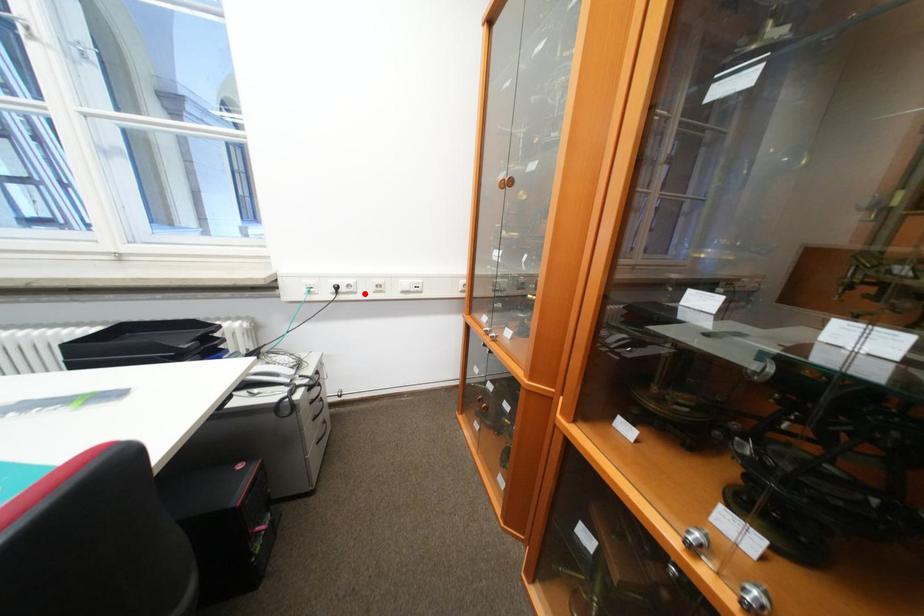
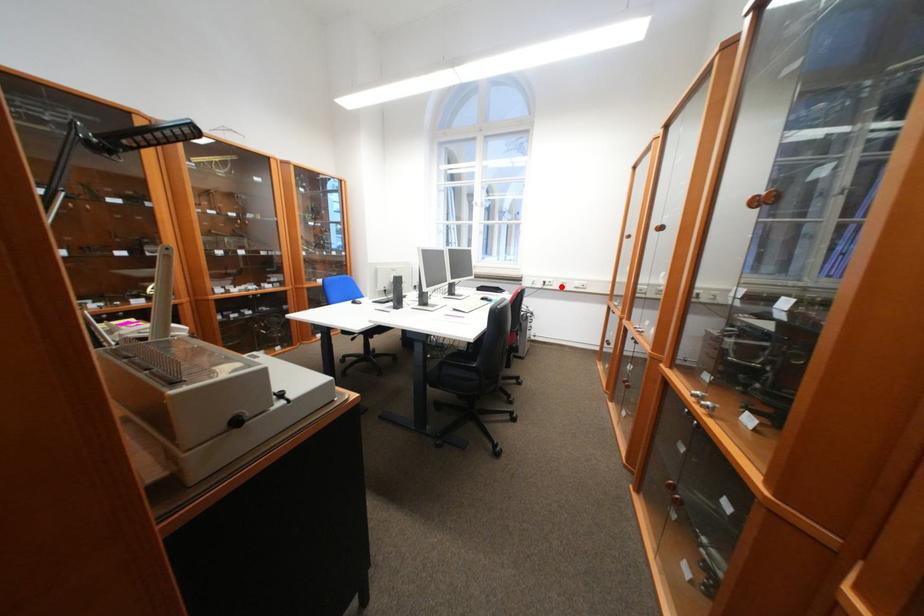
I am providing you with two images of the same scene from different viewpoints. A red point is marked on the first image and another point is marked on the second image. Do the highlighted points in image1 and image2 indicate the same real-world spot?

Yes